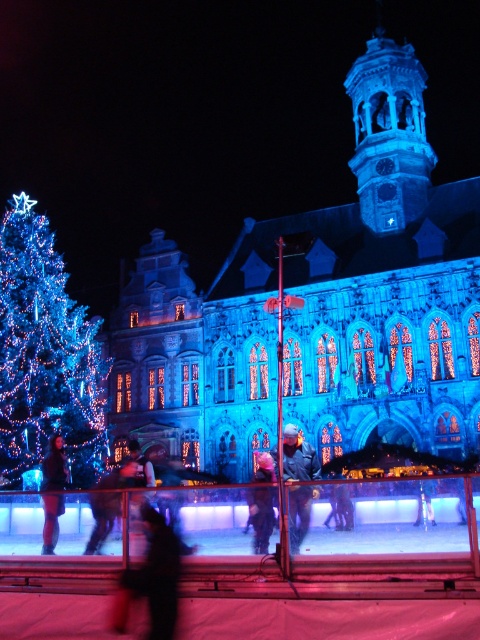
Question: Among these objects, which one is farthest from the camera?

Choices:
 (A) silhouette fabric person at center
 (B) dark blue leather jacket at center
 (C) dark blue fabric jacket at center
 (D) dark brown leather jacket at center

Answer: (D)

Question: Among these objects, which one is farthest from the camera?

Choices:
 (A) dark blue leather jacket at center
 (B) dark blue fabric jacket at center

Answer: (B)

Question: Does silhouette fabric person at center have a lesser width compared to dark blue leather jacket at center?

Choices:
 (A) yes
 (B) no

Answer: (B)

Question: Is illuminated glass christmas tree at left bigger than dark blue leather jacket at center?

Choices:
 (A) no
 (B) yes

Answer: (B)

Question: Estimate the real-world distances between objects in this image. Which object is farther from the illuminated glass christmas tree at left?

Choices:
 (A) dark brown leather jacket at center
 (B) dark blue fabric jacket at center
 (C) silhouette fabric person at center

Answer: (C)

Question: Does illuminated glass christmas tree at left appear on the left side of silhouette fabric person at center?

Choices:
 (A) no
 (B) yes

Answer: (B)